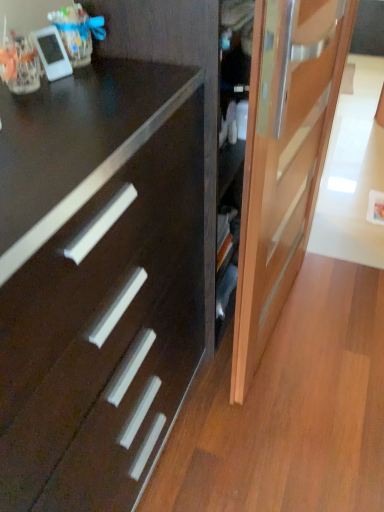
You are a GUI agent. You are given a task and a screenshot of the screen. Output one action in this format:
    pyautogui.click(x=<x>, y=<y>)
    Task: Click on the vacant space in light brown wooden door at right (from a real-world perspective)
    The image size is (384, 512).
    Given the screenshot: What is the action you would take?
    pyautogui.click(x=281, y=328)